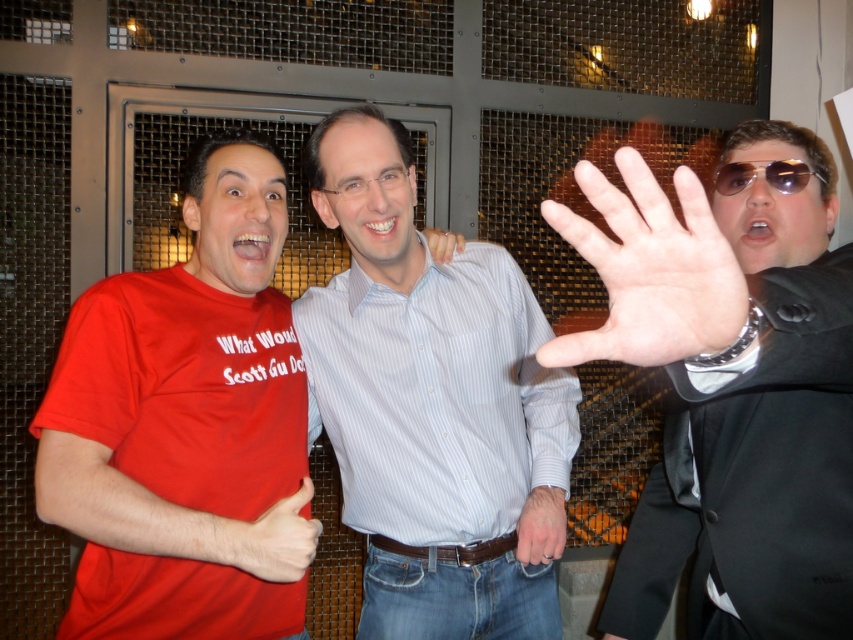
Measure the distance between shiny black suit at right and sunglasses at center.

A distance of 14.68 inches exists between shiny black suit at right and sunglasses at center.

Can you confirm if shiny black suit at right is positioned below sunglasses at center?

Indeed, shiny black suit at right is positioned under sunglasses at center.

From the picture: Who is more forward, (585, 177) or (824, 180)?

Point (585, 177) is in front.

Find the location of a particular element. This screenshot has width=853, height=640. shiny black suit at right is located at coordinates (730, 388).

Does shiny black suit at right have a lesser height compared to light blue striped shirt at center?

In fact, shiny black suit at right may be taller than light blue striped shirt at center.

Between shiny black suit at right and light blue striped shirt at center, which one is positioned lower?

Positioned lower is light blue striped shirt at center.

Who is more distant from viewer, (816, 572) or (492, 403)?

Positioned behind is point (492, 403).

You are a GUI agent. You are given a task and a screenshot of the screen. Output one action in this format:
    pyautogui.click(x=<x>, y=<y>)
    Task: Click on the shiny black suit at right
    This screenshot has height=640, width=853.
    Given the screenshot: What is the action you would take?
    pyautogui.click(x=730, y=388)

Who is taller, light blue striped shirt at center or smooth skin hand at center?

Standing taller between the two is light blue striped shirt at center.

Is light blue striped shirt at center positioned in front of smooth skin hand at center?

No, it is behind smooth skin hand at center.

Image resolution: width=853 pixels, height=640 pixels. In order to click on light blue striped shirt at center in this screenshot , I will do `click(437, 397)`.